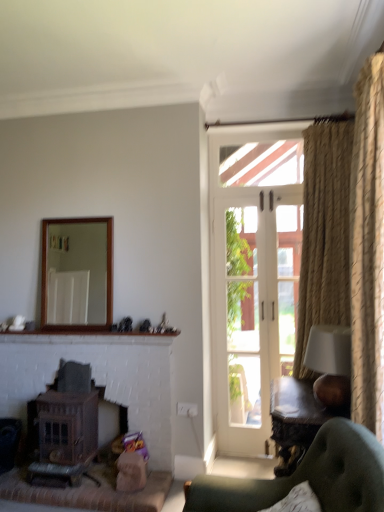
Question: Based on their sizes in the image, would you say green tufted chair at lower right is bigger or smaller than wooden polished table at lower right?

Choices:
 (A) big
 (B) small

Answer: (A)

Question: In terms of width, does green tufted chair at lower right look wider or thinner when compared to wooden polished table at lower right?

Choices:
 (A) thin
 (B) wide

Answer: (B)

Question: Estimate the real-world distances between objects in this image. Which object is farther from the green tufted chair at lower right?

Choices:
 (A) wooden fireplace at lower left, the 1th fireplace when ordered from right to left
 (B) wooden fireplace at lower left, arranged as the 1th fireplace when viewed from the left
 (C) white glass screen door at center
 (D) wooden frame mirror at upper center
 (E) white fabric lampshade at right

Answer: (D)

Question: Based on their relative distances, which object is nearer to the green tufted chair at lower right?

Choices:
 (A) white brick mantle at center
 (B) wooden frame mirror at upper center
 (C) beige textured curtain at right
 (D) white fabric lampshade at right
 (E) wooden fireplace at lower left, marked as the second fireplace in a right-to-left arrangement

Answer: (D)